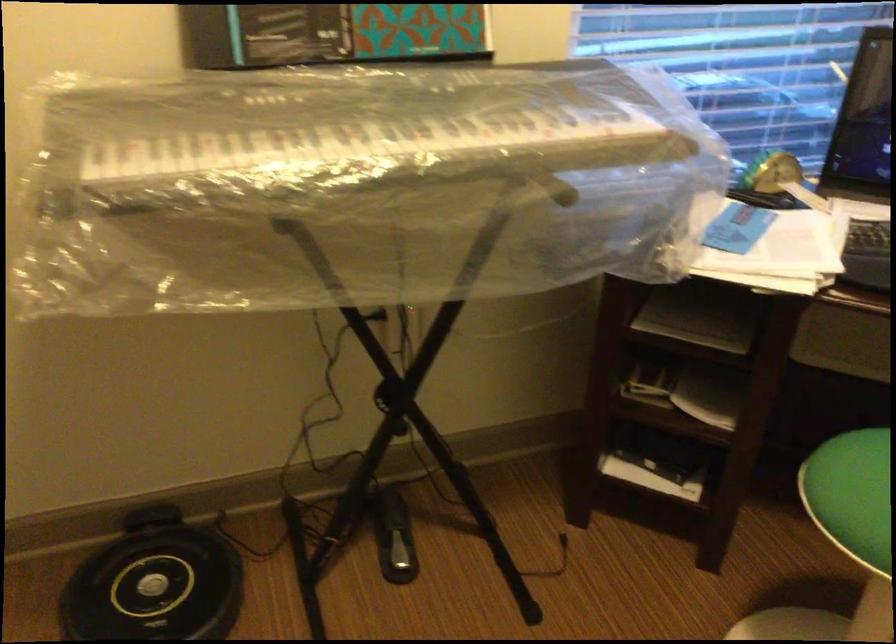
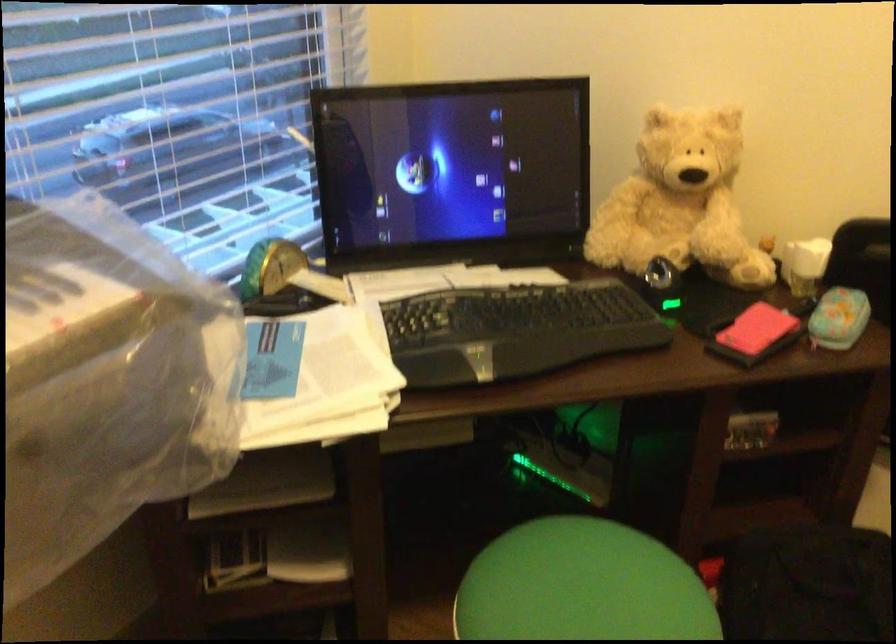
Question: How did the camera likely rotate?

Choices:
 (A) Left
 (B) Right
 (C) Up
 (D) Down

Answer: (B)